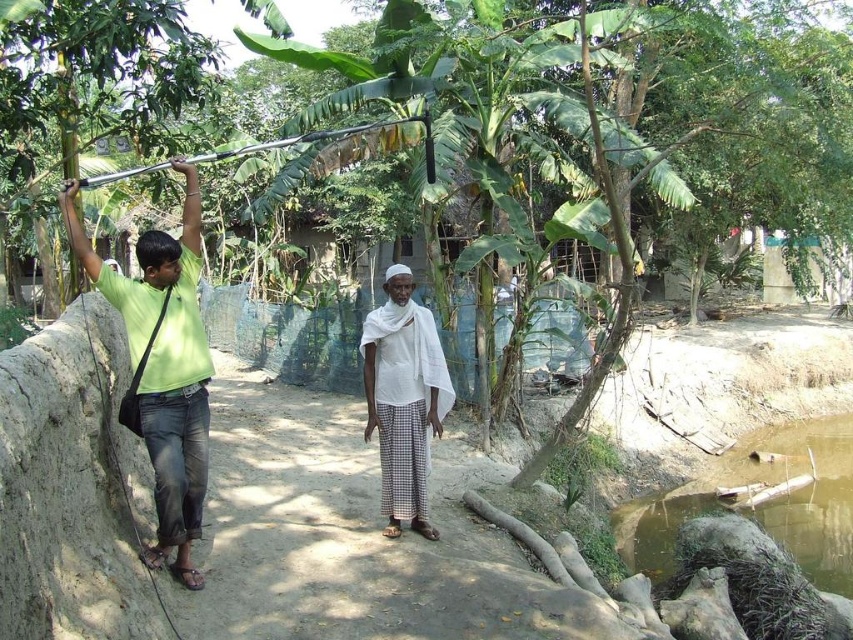
Does green matte shirt at left have a lesser height compared to brown murky water at lower right?

No.

Does green matte shirt at left have a lesser width compared to brown murky water at lower right?

No.

Is point (193, 189) positioned in front of point (808, 536)?

Yes, it is.

You are a GUI agent. You are given a task and a screenshot of the screen. Output one action in this format:
    pyautogui.click(x=<x>, y=<y>)
    Task: Click on the green matte shirt at left
    This screenshot has width=853, height=640.
    Given the screenshot: What is the action you would take?
    pyautogui.click(x=164, y=365)

From the picture: Is brown murky water at lower right above white cotton cloth at center?

No.

Is point (636, 561) positioned in front of point (381, 324)?

No, (636, 561) is further to viewer.

Is point (833, 458) less distant than point (389, 435)?

No, it is behind (389, 435).

Image resolution: width=853 pixels, height=640 pixels. I want to click on brown murky water at lower right, so click(x=759, y=502).

Is point (125, 324) closer to viewer compared to point (390, 413)?

Yes, it is.

Does green matte shirt at left lie in front of white cotton cloth at center?

That is True.

Does point (154, 310) come in front of point (405, 512)?

Yes, it is.

Find the location of `green matte shirt at left`. green matte shirt at left is located at coordinates (164, 365).